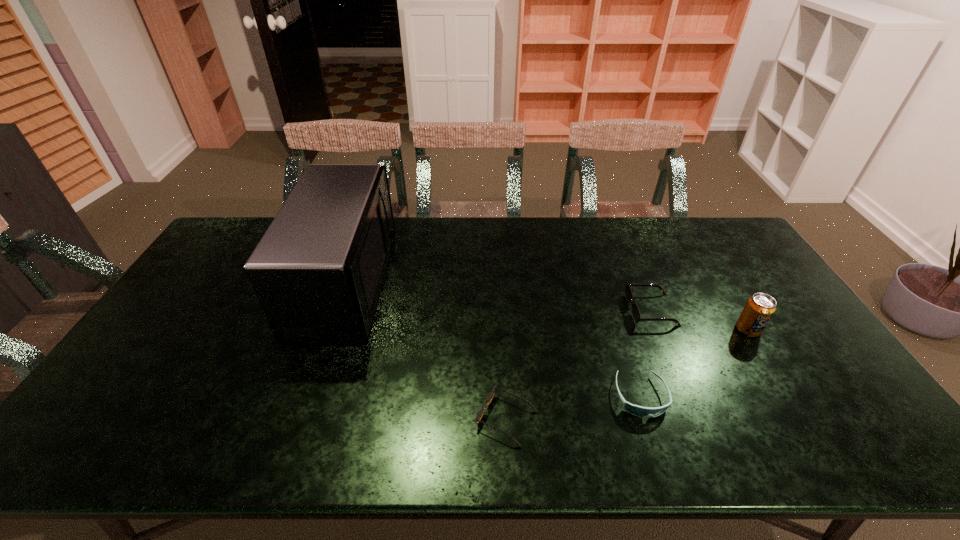
I want to click on object that is at the right edge, so click(759, 309).

Find the location of a particular element. free space at the far edge is located at coordinates (484, 246).

Locate an element on the screen. free space at the near edge of the desktop is located at coordinates (152, 447).

You are a GUI agent. You are given a task and a screenshot of the screen. Output one action in this format:
    pyautogui.click(x=<x>, y=<y>)
    Task: Click on the vacant area at the left edge of the desktop
    
    Given the screenshot: What is the action you would take?
    (x=190, y=325)

Image resolution: width=960 pixels, height=540 pixels. Identify the location of free spot at the near left corner of the desktop. (70, 448).

The image size is (960, 540). In order to click on vacant space at the near right corner of the desktop in this screenshot , I will do `click(847, 443)`.

The height and width of the screenshot is (540, 960). Identify the location of free space between the leftmost object and the fourth shortest object. (547, 307).

The height and width of the screenshot is (540, 960). I want to click on free space between the microwave_oven and the taller sunglasses, so click(499, 297).

Locate an element on the screen. The width and height of the screenshot is (960, 540). vacant space that's between the left sunglasses and the tallest object is located at coordinates (426, 352).

The height and width of the screenshot is (540, 960). Identify the location of vacant area between the taller sunglasses and the goggles. (646, 353).